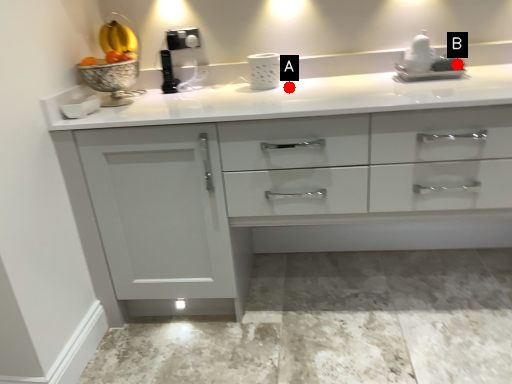
Question: Two points are circled on the image, labeled by A and B beside each circle. Which of the following is the closest to the observer?

Choices:
 (A) A is closer
 (B) B is closer

Answer: (B)